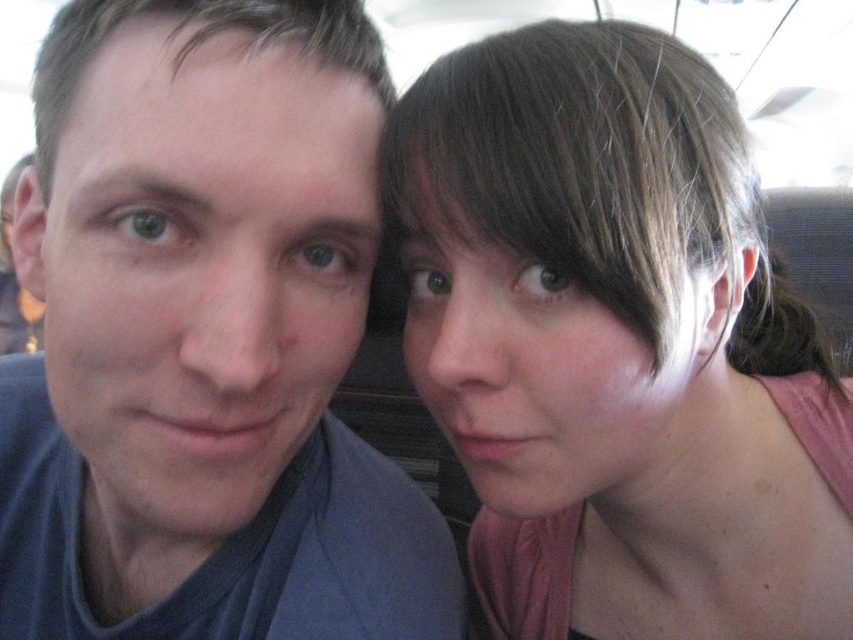
You are a photographer who needs to capture a closeup shot of both the blue matte shirt at left and the pink fabric at upper right in this scene. Based on their current positions, do you think you can fit both into your camera frame without moving either subject?

The distance between the blue matte shirt at left and the pink fabric at upper right is 5.55 inches. Since the photographer can adjust the camera angle or zoom to include both subjects within the frame, it is possible to capture both without moving them.

You are sitting in a vehicle and see two points marked in the scene. The first point is at coordinate point (358, 195) and the second is at point (738, 458). If you want to reach the point that is closer to you, which coordinate should you go to?

The point at coordinate point (358, 195) is closer to you because it is in front of point (738, 458).